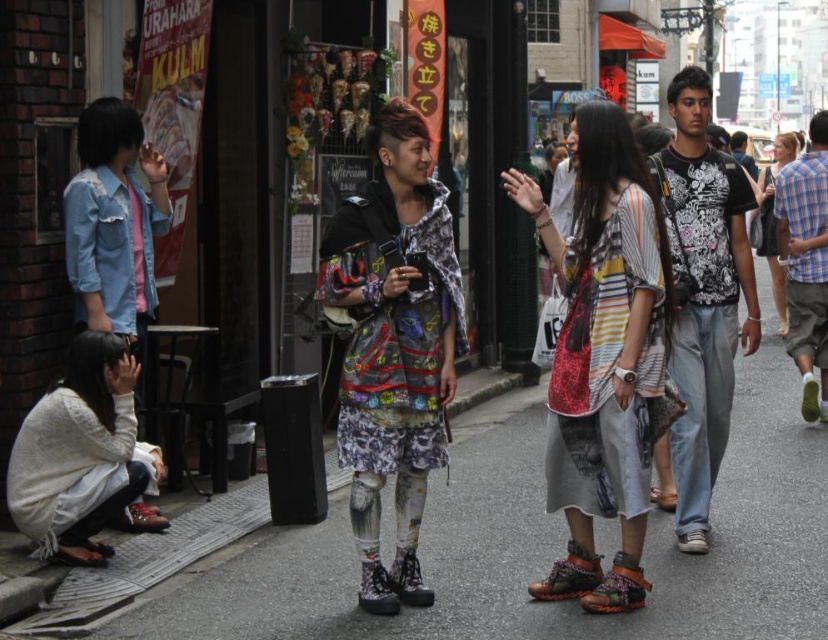
Is point (339, 234) farther from camera compared to point (124, 520)?

That is False.

Between point (360, 356) and point (118, 528), which one is positioned behind?

The point (118, 528) is behind.

Is point (359, 369) more distant than point (130, 506)?

No.

In order to click on printed fabric dress at center in this screenshot , I will do `click(393, 346)`.

Is matte concrete pavement at center smaller than printed fabric dress at center?

Yes, matte concrete pavement at center is smaller than printed fabric dress at center.

Image resolution: width=828 pixels, height=640 pixels. I want to click on matte concrete pavement at center, so click(x=497, y=548).

Is point (364, 602) more distant than point (555, 561)?

No, it is not.

Does printed fabric dress at center have a greater width compared to leather textured sandal at lower center?

Indeed, printed fabric dress at center has a greater width compared to leather textured sandal at lower center.

Describe the element at coordinates (393, 346) in the screenshot. I see `printed fabric dress at center` at that location.

At what (x,y) coordinates should I click in order to perform the action: click on printed fabric dress at center. Please return your answer as a coordinate pair (x, y). Looking at the image, I should click on (393, 346).